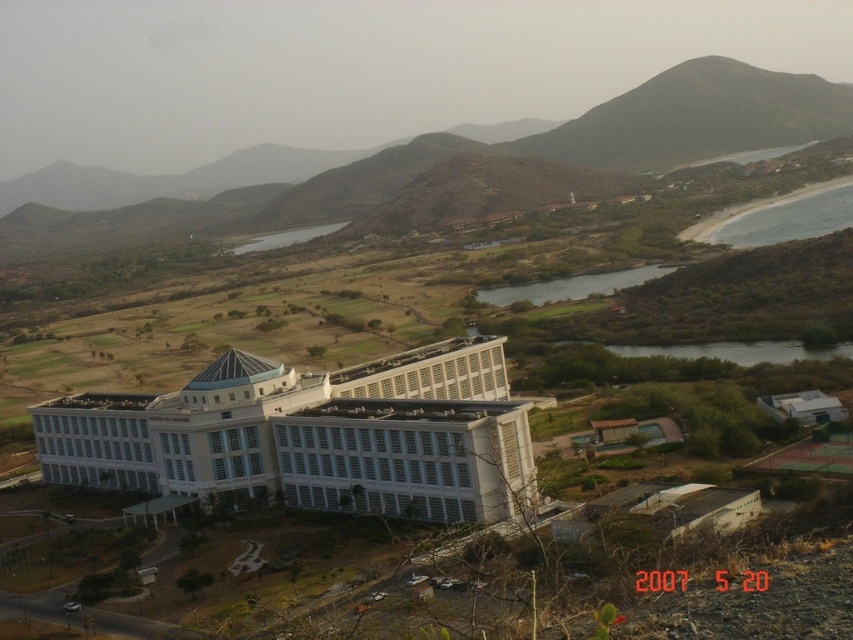
You are a drone operator trying to capture aerial footage of the white glass building at center and the gray sand beach at lower right. Based on the scene, which object is positioned higher from the ground level?

The gray sand beach at lower right is higher than the white glass building at center because the white glass building at center is located below it.

You are a drone operator planning to fly a drone from the white glass building at center to the gray sand beach at lower right. Considering the spatial relationship between these two objects, which direction should you fly the drone to reach the beach?

The gray sand beach at lower right is located to the right side of the white glass building at center, so you should fly the drone towards the right direction to reach the beach.